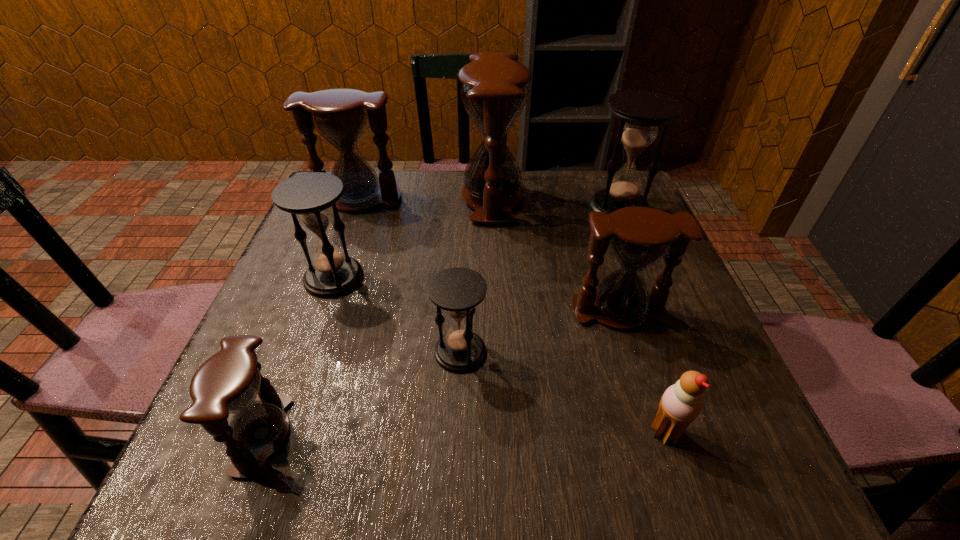
This screenshot has width=960, height=540. In order to click on object that is positioned at the near right corner in this screenshot , I will do `click(681, 403)`.

You are a GUI agent. You are given a task and a screenshot of the screen. Output one action in this format:
    pyautogui.click(x=<x>, y=<y>)
    Task: Click on the free region at the far edge of the desktop
    This screenshot has width=960, height=540.
    Given the screenshot: What is the action you would take?
    pyautogui.click(x=543, y=197)

Identify the location of vacant space at the near edge. (629, 486).

In order to click on blank space at the left edge of the desktop in this screenshot , I will do `click(259, 336)`.

Where is `vacant space at the right edge of the desktop`? vacant space at the right edge of the desktop is located at coordinates (627, 339).

Where is `free point between the smallest brown hourglass and the smallest black hourglass`? Image resolution: width=960 pixels, height=540 pixels. free point between the smallest brown hourglass and the smallest black hourglass is located at coordinates (362, 394).

Locate an element on the screen. The width and height of the screenshot is (960, 540). free spot between the nearest hourglass and the tallest hourglass is located at coordinates (377, 316).

This screenshot has width=960, height=540. In order to click on free space between the nearest hourglass and the second biggest black hourglass in this screenshot , I will do `click(299, 356)`.

This screenshot has width=960, height=540. I want to click on free space between the smallest black hourglass and the biggest black hourglass, so click(x=540, y=280).

Locate an element on the screen. This screenshot has height=540, width=960. unoccupied area between the biggest black hourglass and the nearest black hourglass is located at coordinates (540, 280).